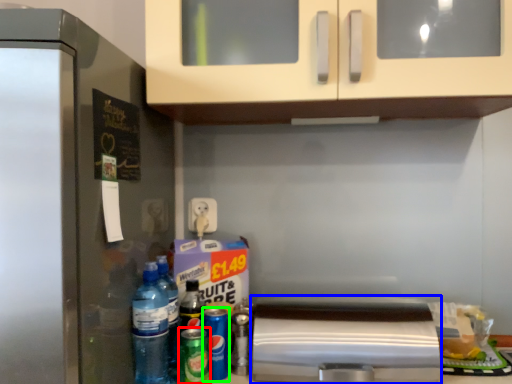
Question: Based on their relative distances, which object is farther from beer (highlighted by a red box)? Choose from appliance (highlighted by a blue box) and beer (highlighted by a green box).

Choices:
 (A) appliance
 (B) beer

Answer: (A)